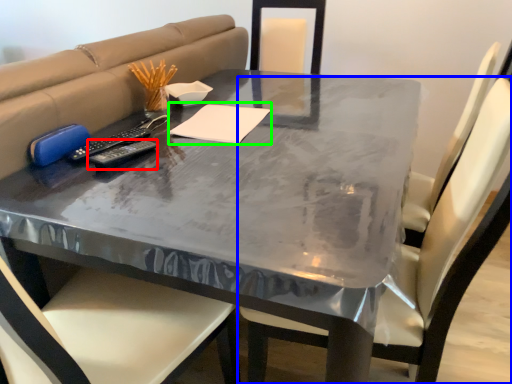
Question: Estimate the real-world distances between objects in this image. Which object is farther from remote (highlighted by a red box), chair (highlighted by a blue box) or notepad (highlighted by a green box)?

Choices:
 (A) chair
 (B) notepad

Answer: (A)